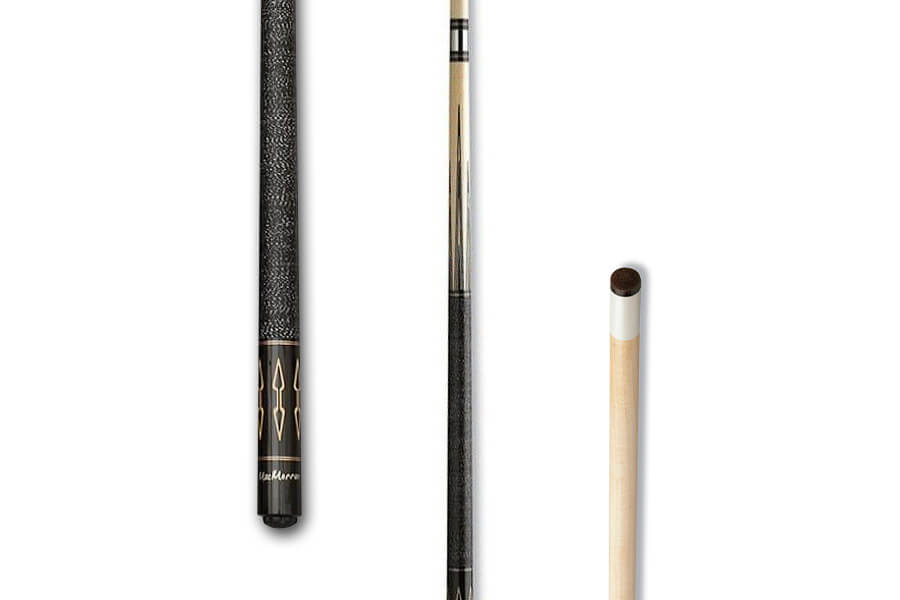
Image resolution: width=900 pixels, height=600 pixels. Identify the location of light wood. (625, 488), (461, 83).